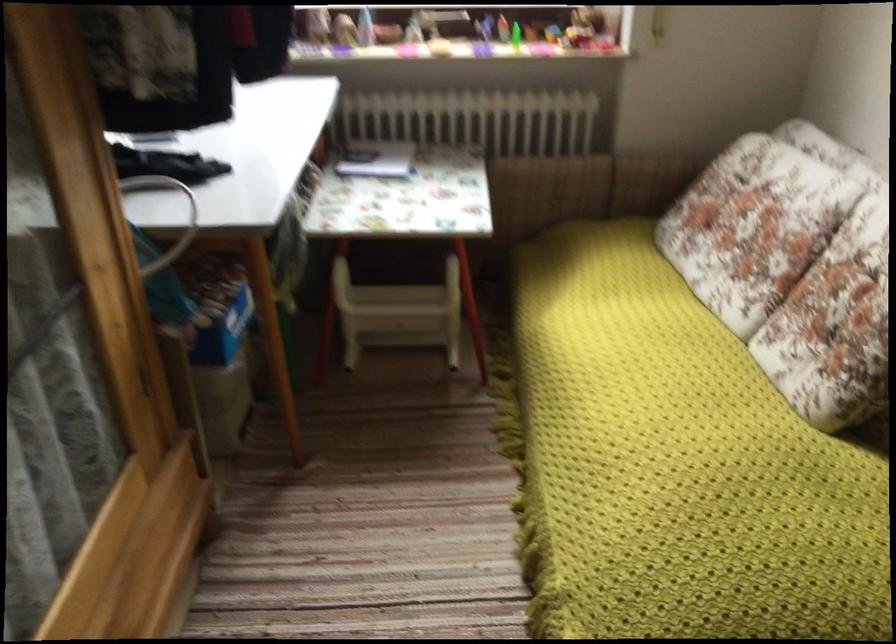
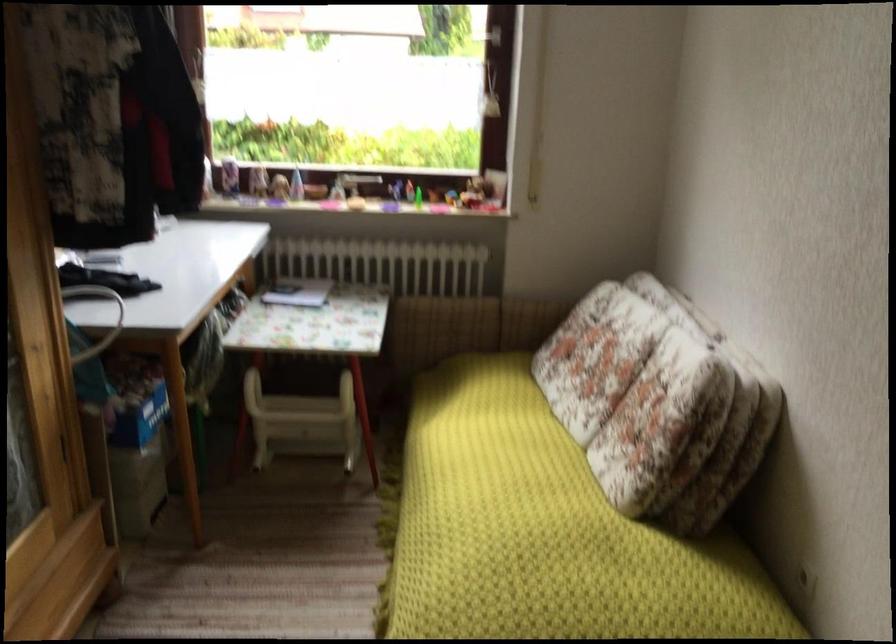
The point at (x=737, y=464) is marked in the first image. Where is the corresponding point in the second image?

(544, 532)